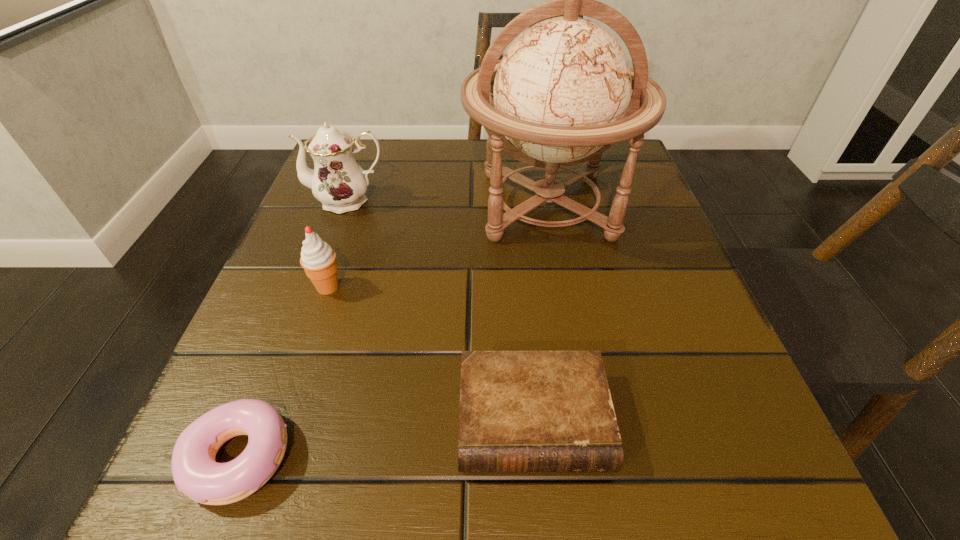
Locate an element on the screen. globe is located at coordinates (561, 94).

The width and height of the screenshot is (960, 540). I want to click on chinaware, so click(338, 182).

I want to click on the third farthest object, so click(318, 259).

Locate an element on the screen. icecream is located at coordinates (318, 259).

This screenshot has width=960, height=540. Identify the location of diary. (520, 411).

At what (x,y) coordinates should I click in order to perform the action: click on doughnut. Please return your answer as a coordinate pair (x, y). Image resolution: width=960 pixels, height=540 pixels. Looking at the image, I should click on (195, 472).

What are the coordinates of `vacant space located 0.280m on the front-facing side of the globe` in the screenshot? It's located at (585, 412).

In order to click on vacant area situated 0.060m on the right of the second tallest object in this screenshot , I will do `click(419, 200)`.

This screenshot has height=540, width=960. Identify the location of vacant space situated on the back of the third shortest object. (353, 211).

Where is `blank space located on the right of the doughnut`? The image size is (960, 540). blank space located on the right of the doughnut is located at coordinates (521, 455).